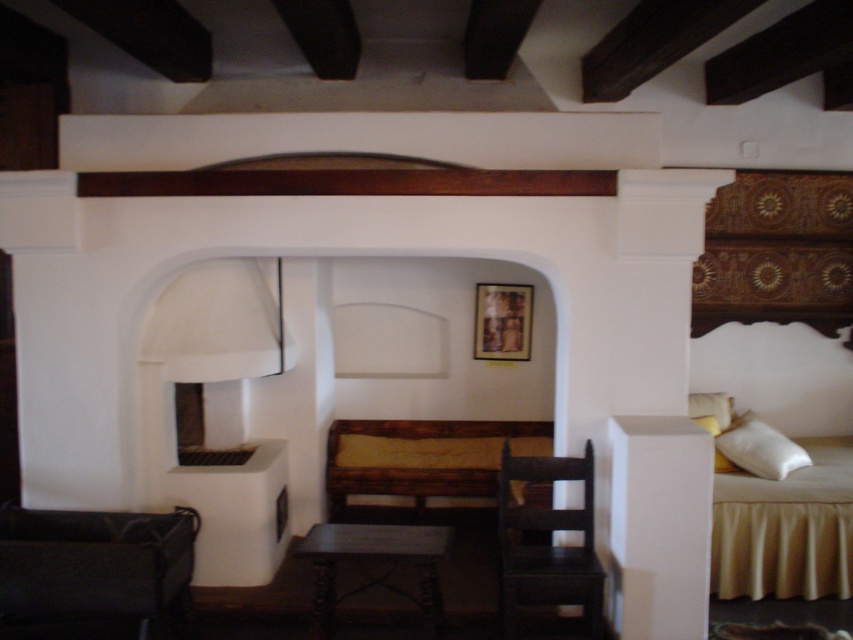
You are planning to place a rectangular coffee table between the black fabric armchair at lower left and the dark wood chair at center. The coffee table is 4 feet long. Will there be enough space between them to fit the coffee table?

The distance between the black fabric armchair at lower left and the dark wood chair at center is 4.79 feet. Since the coffee table is 4 feet long, there will be enough space to fit it between them.

You are standing at the center of the room and want to sit down. There is a black fabric armchair at lower left near point (93,573). Is the black fabric armchair at lower left closer to the bed or the bench?

The black fabric armchair at lower left is closer to the bed than the bench.